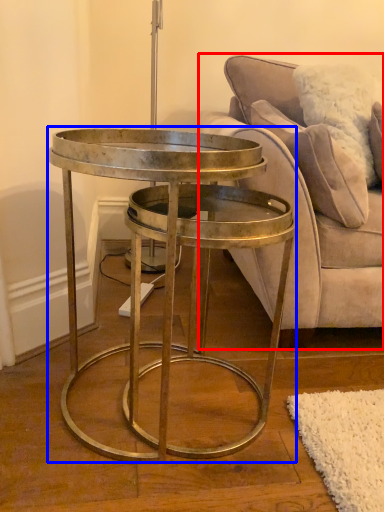
Question: Which point is closer to the camera, studio couch (highlighted by a red box) or coffee table (highlighted by a blue box)?

Choices:
 (A) studio couch
 (B) coffee table

Answer: (B)